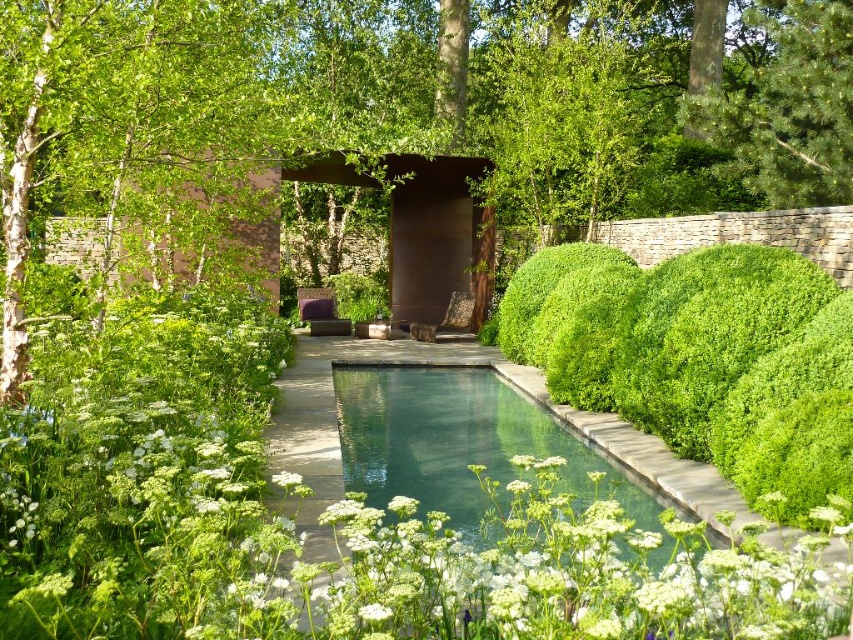
You are standing in the garden and want to take a photo of the clear glass pool at center and the green pine tree at upper right. Which object will appear larger in your photo?

The clear glass pool at center will appear larger in the photo because it is closer to the viewer than the green pine tree at upper right.

You are a gardener planning to plant a new flower bed. You want to ensure it doesn not block the view of the clear glass pool at center from the green pine tree at upper right. Where should you avoid placing the flower bed?

You should avoid placing the flower bed between the clear glass pool at center and the green pine tree at upper right, as the clear glass pool at center is below the green pine tree at upper right and blocking that area would obstruct the view.

You are standing at the edge of the pool in the garden. You see two points marked in the image. One is at point (538, 433) and the other is at point (735, 148). Which point is closer to you?

Point (538, 433) is in front of point (735, 148), so the point at (538, 433) is closer to you.